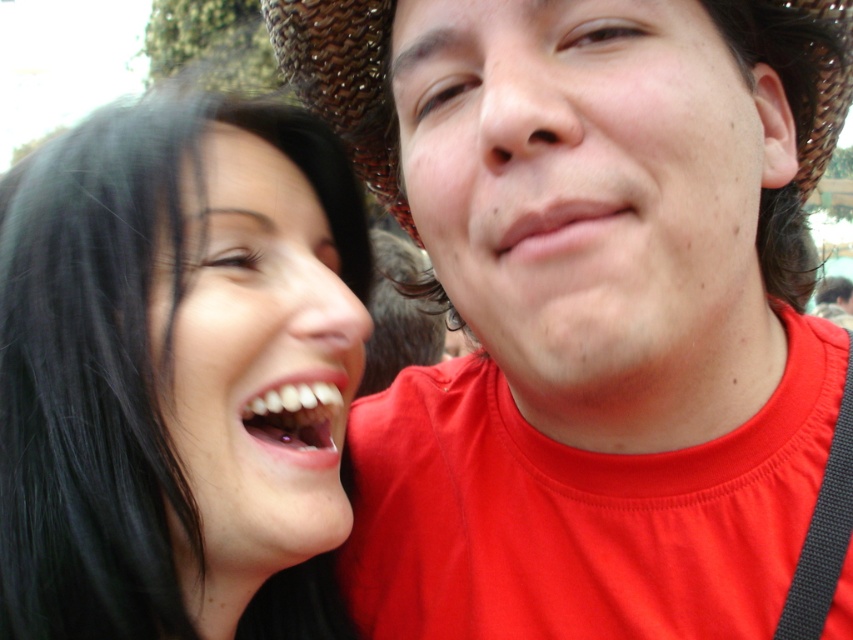
Measure the distance between point (x=178, y=112) and camera.

Point (x=178, y=112) and camera are 1.08 meters apart from each other.

Does black hair at left appear on the left side of white glossy teeth at center?

Indeed, black hair at left is positioned on the left side of white glossy teeth at center.

Identify the location of black hair at left. The width and height of the screenshot is (853, 640). (178, 372).

Which is in front, point (6, 177) or point (161, 332)?

Point (161, 332) is in front.

From the picture: Between black hair at left and matte black hair at left, which one is positioned lower?

black hair at left is lower down.

Where is `black hair at left`? The width and height of the screenshot is (853, 640). black hair at left is located at coordinates (178, 372).

Locate an element on the screen. black hair at left is located at coordinates (178, 372).

Which is in front, point (206, 225) or point (329, 451)?

Point (206, 225) is more forward.

Who is lower down, matte black hair at left or white glossy teeth at center?

Positioned lower is white glossy teeth at center.

Describe the element at coordinates (256, 356) in the screenshot. I see `matte black hair at left` at that location.

This screenshot has height=640, width=853. Find the location of `matte black hair at left`. matte black hair at left is located at coordinates (256, 356).